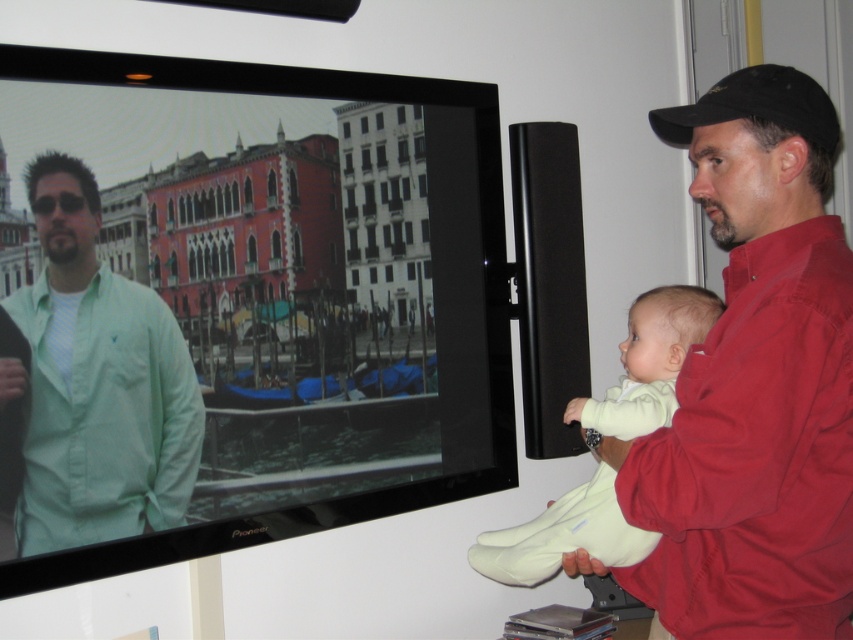
You are a home decorator planning to hang a new painting between the matte black television at upper left and the red cotton shirt at right. Based on their positions, where should the painting be placed?

The matte black television at upper left is above the red cotton shirt at right, so the painting should be placed between them vertically, centered between the two objects.

You are a delivery robot in a home. You need to place a package on the floor between the matte black television at upper left and the black fabric baseball cap at upper right. The package is 30 inches long. Can you fit the package between them?

The distance between the matte black television at upper left and the black fabric baseball cap at upper right is 32.89 inches. Since the package is 30 inches long, it can fit between them as there is enough space.

You are a visitor in this room and want to know which object is bigger between the matte black television at upper left and the black fabric baseball cap at upper right. Can you tell me?

The matte black television at upper left is larger in size than the black fabric baseball cap at upper right.